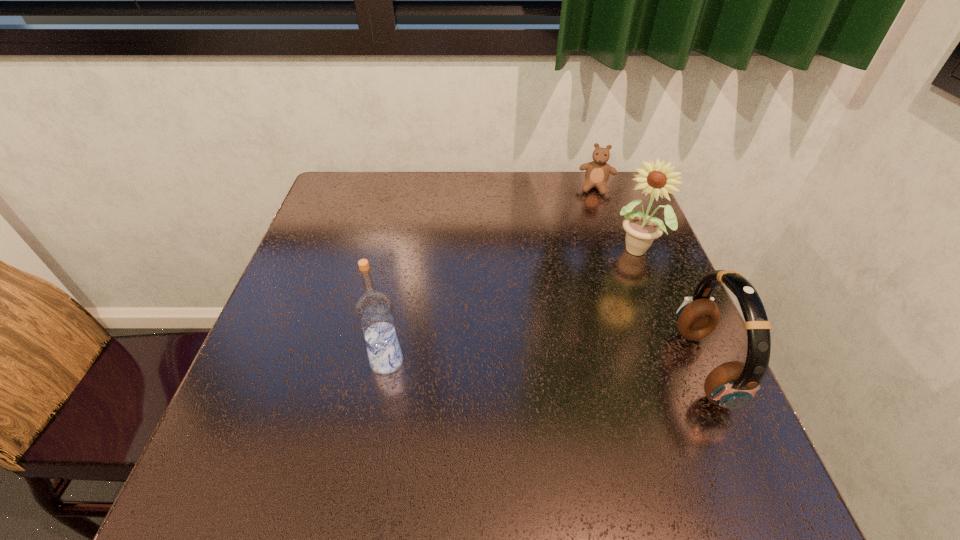
Locate an element on the screen. Image resolution: width=960 pixels, height=540 pixels. free space between the farthest object and the vodka is located at coordinates 492,274.

Find the location of `free space between the teddy bear and the headset`. free space between the teddy bear and the headset is located at coordinates (650, 278).

The height and width of the screenshot is (540, 960). Find the location of `unoccupied area between the sunflower and the teddy bear`. unoccupied area between the sunflower and the teddy bear is located at coordinates (616, 219).

Identify the location of free space that is in between the sunflower and the vodka. The width and height of the screenshot is (960, 540). (511, 306).

Where is `free spot between the shortest object and the headset`? free spot between the shortest object and the headset is located at coordinates (650, 278).

Where is `empty space between the shortest object and the leftmost object`? The image size is (960, 540). empty space between the shortest object and the leftmost object is located at coordinates (492, 274).

I want to click on free space between the second shortest object and the vodka, so click(x=545, y=364).

Select which object appears as the third closest to the vodka. Please provide its 2D coordinates. Your answer should be formatted as a tuple, i.e. [(x, y)], where the tuple contains the x and y coordinates of a point satisfying the conditions above.

[(597, 172)]

This screenshot has width=960, height=540. In order to click on the closest object to the sunflower in this screenshot , I will do `click(597, 172)`.

Find the location of `free space that satisfies the following two spatial constraints: 1. on the front side of the headset; 2. on the ear cup of the leftmost object`. free space that satisfies the following two spatial constraints: 1. on the front side of the headset; 2. on the ear cup of the leftmost object is located at coordinates (386, 367).